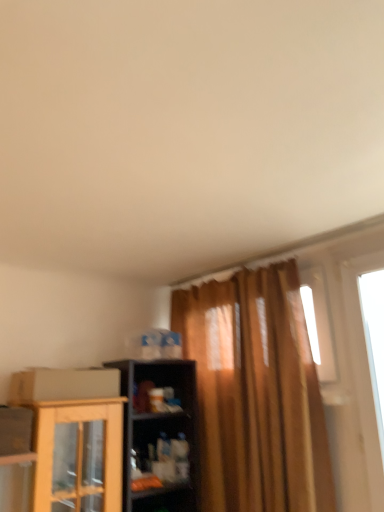
Question: Is point (190, 419) positioned closer to the camera than point (51, 398)?

Choices:
 (A) closer
 (B) farther

Answer: (B)

Question: Would you say matte plastic shelf at center is to the left or to the right of cardboard box at lower left in the picture?

Choices:
 (A) left
 (B) right

Answer: (B)

Question: Which of these objects is positioned closest to the cardboard box at lower left?

Choices:
 (A) matte plastic shelf at center
 (B) transparent glass window at right

Answer: (A)

Question: Which object is positioned closest to the cardboard box at lower left?

Choices:
 (A) matte plastic shelf at center
 (B) transparent glass window at right

Answer: (A)